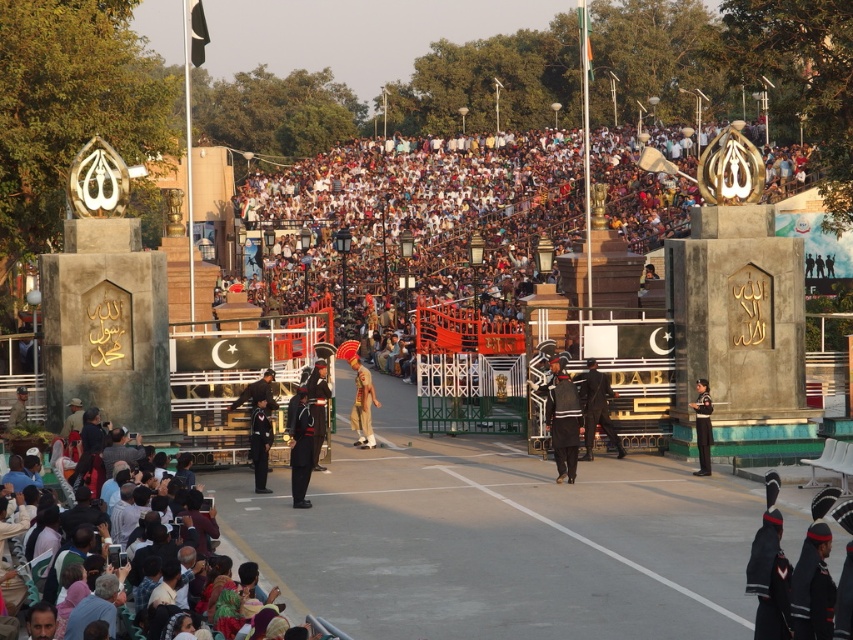
You are a photographer positioned at point A. You want to capture a photo that includes both the point at (x=461, y=163) and the point at (x=244, y=484). Which point should you focus on first to ensure both are in the frame?

Since point (x=461, y=163) is behind point (x=244, y=484), you should focus on the closer point (x=244, y=484) first to ensure both are in the frame.

You are a photographer at the border closing ceremony. You want to capture a photo that includes both the dark brown crowd at center and the dark blue uniform at center. Which of these two objects should be placed in the foreground to ensure the other is visible in the background?

The dark brown crowd at center is positioned over dark blue uniform at center. To ensure the dark blue uniform at center is visible in the background, the dark brown crowd at center should be placed in the foreground.

You are a photographer at the ceremony and want to capture a photo that includes both the dark brown crowd at center and the dark blue uniform at center. Based on their positions, which one should be positioned to the left in the photo?

The dark brown crowd at center should be positioned to the left in the photo because it is located to the left of the dark blue uniform at center according to the description.